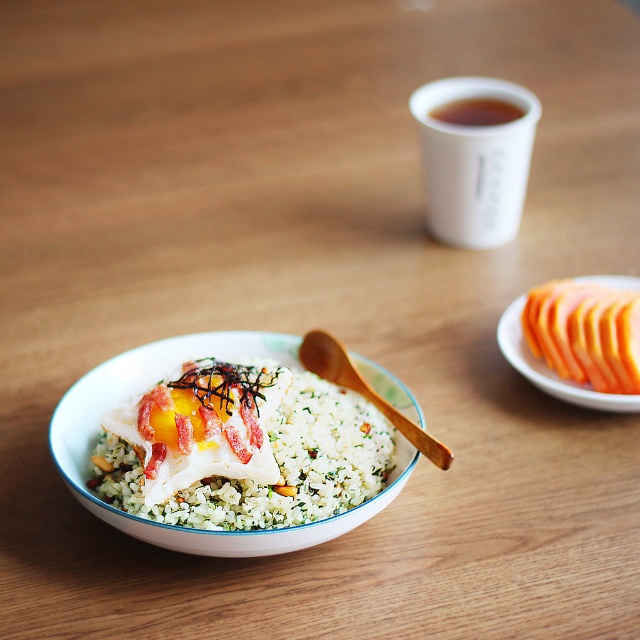
Does wooden spoon at center have a greater width compared to brown paper cup at upper center?

Indeed, wooden spoon at center has a greater width compared to brown paper cup at upper center.

Who is more distant from viewer, (x=360, y=385) or (x=445, y=120)?

The point (x=445, y=120) is behind.

Between point (349, 387) and point (481, 102), which one is positioned in front?

Point (349, 387) is more forward.

You are a GUI agent. You are given a task and a screenshot of the screen. Output one action in this format:
    pyautogui.click(x=<x>, y=<y>)
    Task: Click on the wooden spoon at center
    
    Given the screenshot: What is the action you would take?
    pyautogui.click(x=364, y=390)

Which is in front, point (305, 445) or point (433, 449)?

Point (433, 449) is in front.

Is white textured rice at center further to camera compared to wooden spoon at center?

That is True.

Based on the photo, measure the distance between point (342, 493) and camera.

Point (342, 493) is 1.19 meters from camera.

You are a GUI agent. You are given a task and a screenshot of the screen. Output one action in this format:
    pyautogui.click(x=<x>, y=<y>)
    Task: Click on the white textured rice at center
    The image size is (640, 640).
    Given the screenshot: What is the action you would take?
    pyautogui.click(x=276, y=461)

Who is more distant from viewer, (486, 118) or (550, 316)?

The point (486, 118) is behind.

Is white matte cup at upper center above smooth orange slices at right?

Yes.

The image size is (640, 640). Describe the element at coordinates (474, 156) in the screenshot. I see `white matte cup at upper center` at that location.

The width and height of the screenshot is (640, 640). Find the location of `white matte cup at upper center`. white matte cup at upper center is located at coordinates (474, 156).